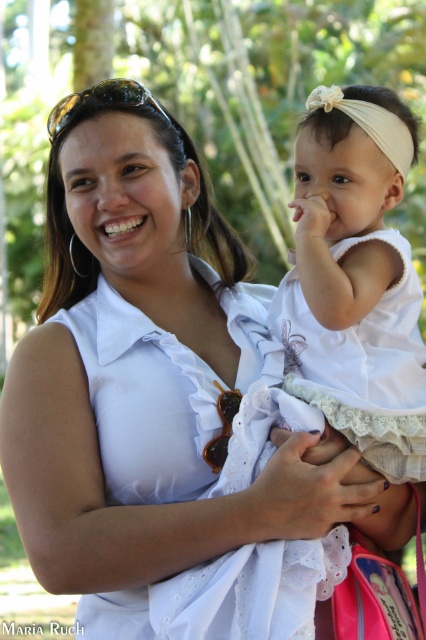
Based on the scene description, where is the white lace dress at center positioned in relation to the woman and the child?

The white lace dress at center is located at point 0.436 on the horizontal axis and 0.836 on the vertical axis, which places it centrally within the frame, likely on the child who is positioned on the right side of the image.

You are taking a photo of two points in the scene. The first point is point (301, 371) and the second point is point (388, 157). Which point will appear larger in your photo?

Point (301, 371) is further to the camera than point (388, 157), so it will appear larger in the photo.